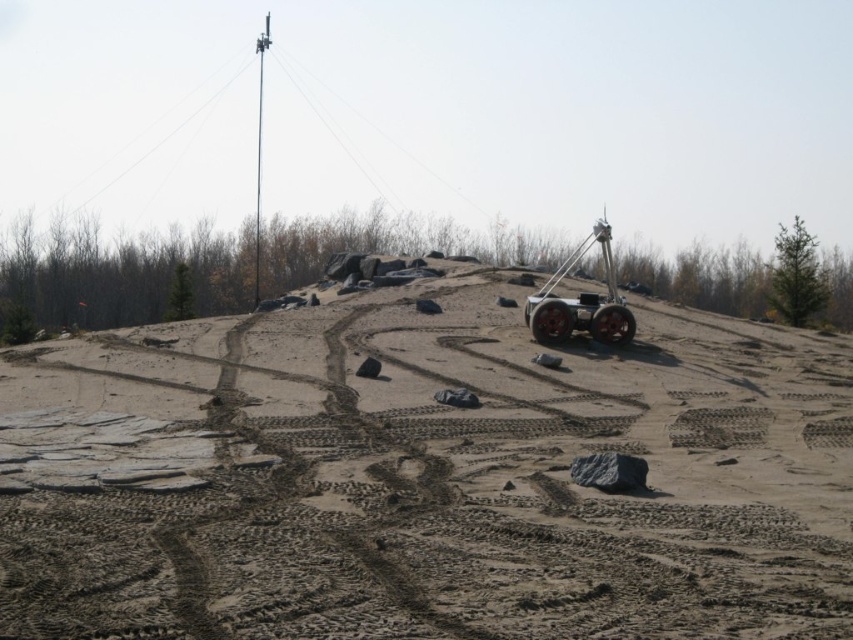
You are a technician inspecting the rover and tire. You need to reach both the metallic red rover at upper right and the black rubber tire at center. Which object should you approach first to reach the closer one?

You should approach the metallic red rover at upper right first because it is closer to you than the black rubber tire at center.

You are a drone operator trying to land a drone on the brown sandy terrain at center. The drone requires a flat area that is taller than the metallic red rover at upper right. Can you land the drone there?

The brown sandy terrain at center is not as tall as metallic red rover at upper right, so it is shorter than the rover. Therefore, the drone cannot land there because the terrain is not taller than the rover.